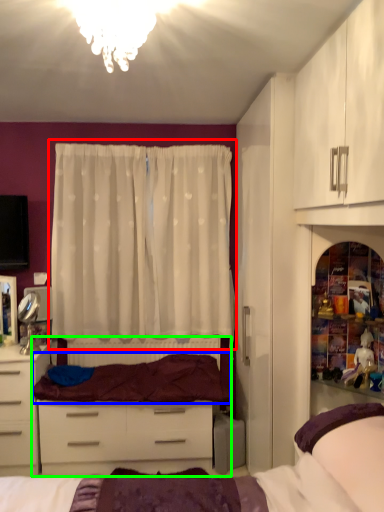
Question: Considering the real-world distances, which object is farthest from curtain (highlighted by a red box)? bedding (highlighted by a blue box) or entertainment center (highlighted by a green box)?

Choices:
 (A) bedding
 (B) entertainment center

Answer: (B)